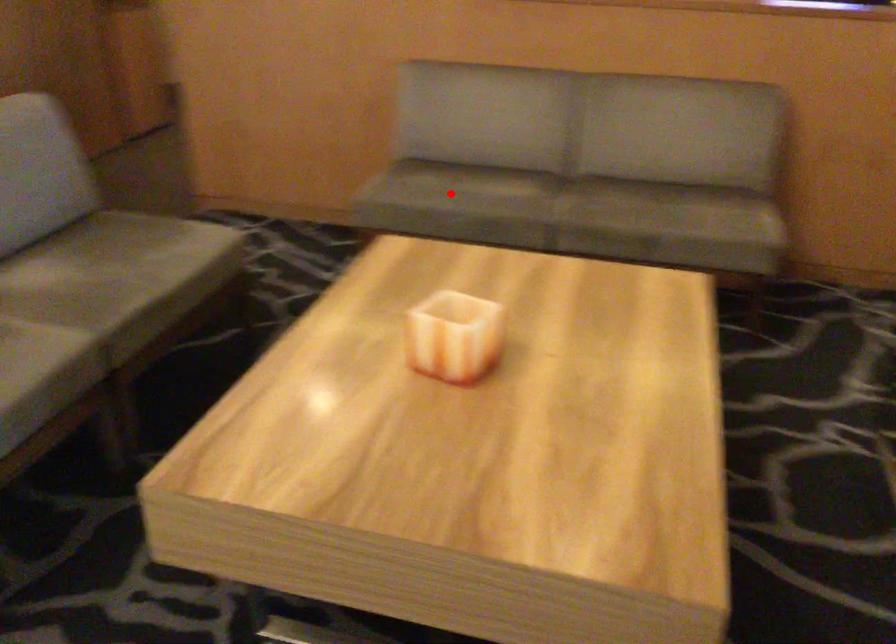
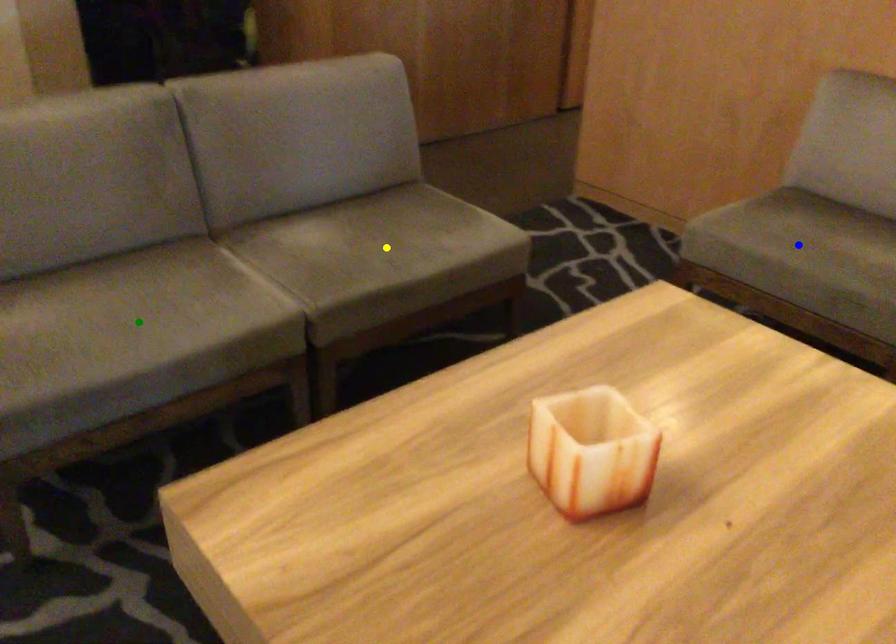
Question: I am providing you with two images of the same scene from different viewpoints. A red point is marked on the first image. You are given multiple points on the second image. Which point in image 2 is actually the same real-world point as the red point in image 1?

Choices:
 (A) yellow point
 (B) green point
 (C) blue point

Answer: (C)